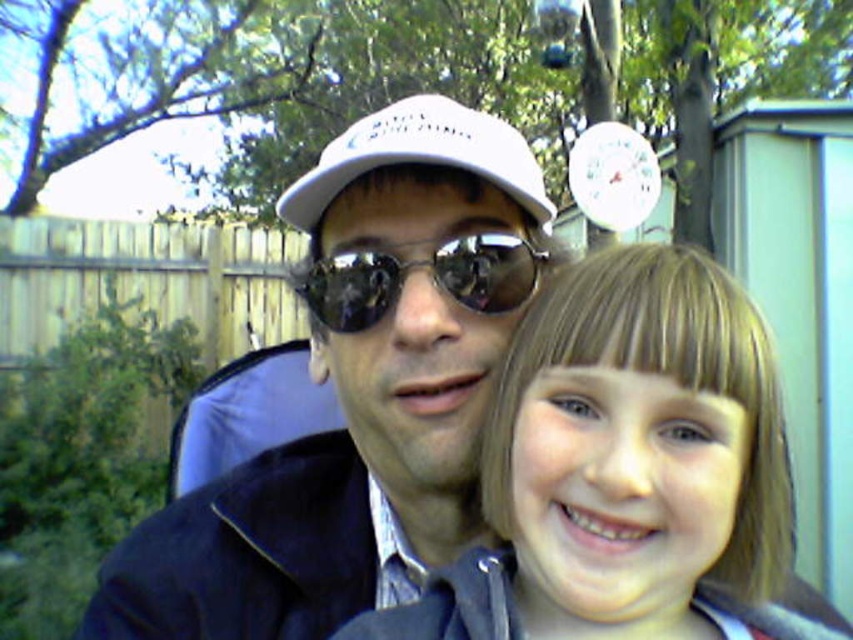
Consider the image. Who is more forward, (355, 428) or (350, 320)?

Point (350, 320) is more forward.

Does point (299, 512) come closer to viewer compared to point (445, 275)?

That is False.

Image resolution: width=853 pixels, height=640 pixels. I want to click on matte white cap at center, so click(x=358, y=392).

Can you confirm if matte white cap at center is taller than smooth blonde hair at center?

Yes, matte white cap at center is taller than smooth blonde hair at center.

Between matte white cap at center and smooth blonde hair at center, which one is positioned lower?

Positioned lower is smooth blonde hair at center.

Does point (408, 420) come behind point (663, 314)?

Yes, it is.

The height and width of the screenshot is (640, 853). What are the coordinates of `matte white cap at center` in the screenshot? It's located at (358, 392).

Is white matte baseball cap at center thinner than shiny reflective sunglasses at center?

No.

From the picture: Which of these two, white matte baseball cap at center or shiny reflective sunglasses at center, stands shorter?

shiny reflective sunglasses at center is shorter.

I want to click on white matte baseball cap at center, so click(x=421, y=156).